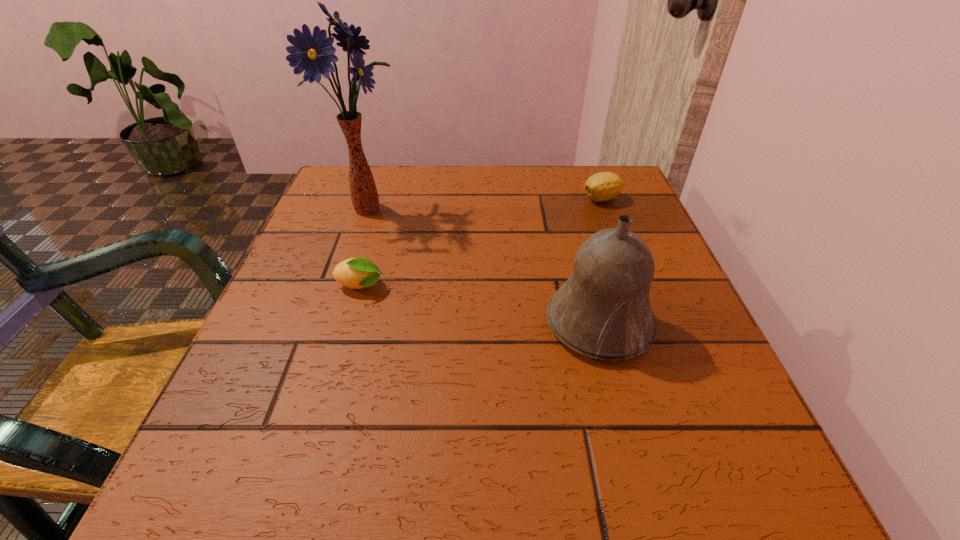
Locate an element on the screen. Image resolution: width=960 pixels, height=540 pixels. flower arrangement positioned at the far edge is located at coordinates (313, 53).

This screenshot has width=960, height=540. Identify the location of lemon that is at the far edge. (604, 186).

Identify the location of flower arrangement that is at the left edge. This screenshot has height=540, width=960. (313, 53).

Where is `lemon at the left edge`? Image resolution: width=960 pixels, height=540 pixels. lemon at the left edge is located at coordinates (356, 273).

Where is `bell that is at the right edge`? This screenshot has width=960, height=540. bell that is at the right edge is located at coordinates (x=603, y=311).

Where is `lemon situated at the right edge`? The height and width of the screenshot is (540, 960). lemon situated at the right edge is located at coordinates (604, 186).

Locate an element on the screen. Image resolution: width=960 pixels, height=540 pixels. object that is at the far left corner is located at coordinates (313, 53).

Image resolution: width=960 pixels, height=540 pixels. Find the location of `object present at the far right corner`. object present at the far right corner is located at coordinates (604, 186).

This screenshot has height=540, width=960. I want to click on vacant space at the far edge of the desktop, so click(x=504, y=177).

This screenshot has height=540, width=960. Identify the location of free space at the left edge of the desktop. (309, 333).